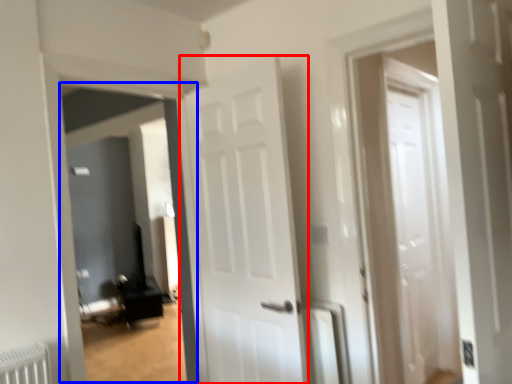
Question: Which object is further to the camera taking this photo, door (highlighted by a red box) or corridor (highlighted by a blue box)?

Choices:
 (A) door
 (B) corridor

Answer: (B)